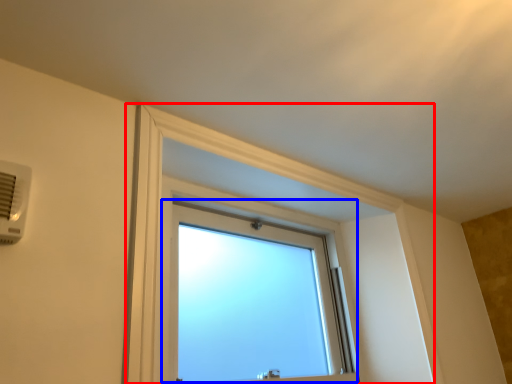
Question: Which point is further to the camera, bay window (highlighted by a red box) or window (highlighted by a blue box)?

Choices:
 (A) bay window
 (B) window

Answer: (B)